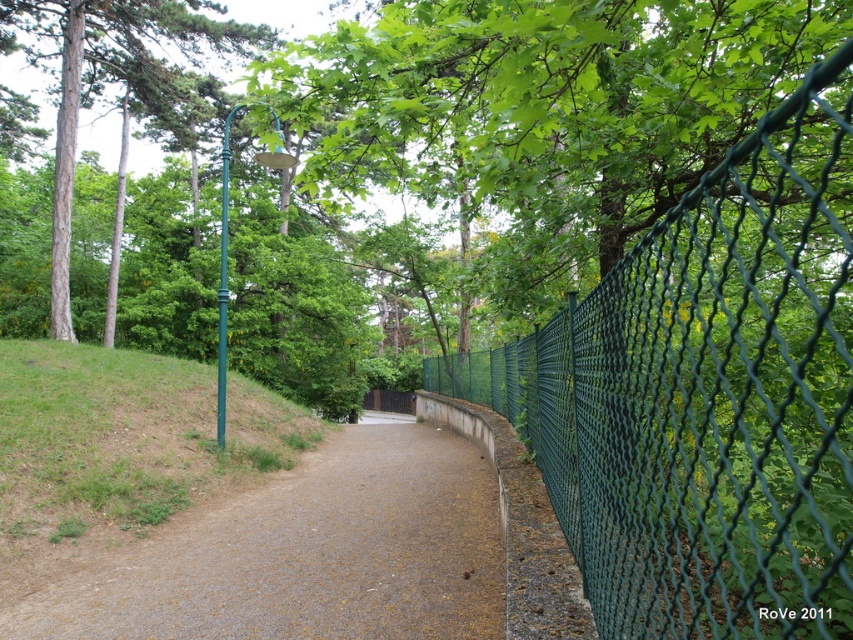
Is green mesh fence at right smaller than green metallic pole at upper center?

Yes.

Who is lower down, green mesh fence at right or green metallic pole at upper center?

Positioned lower is green mesh fence at right.

You are a GUI agent. You are given a task and a screenshot of the screen. Output one action in this format:
    pyautogui.click(x=<x>, y=<y>)
    Task: Click on the green mesh fence at right
    Image resolution: width=853 pixels, height=640 pixels.
    Given the screenshot: What is the action you would take?
    pyautogui.click(x=706, y=394)

Find the location of a particular element. This screenshot has height=640, width=853. green mesh fence at right is located at coordinates [706, 394].

What do you see at coordinates (706, 394) in the screenshot? I see `green mesh fence at right` at bounding box center [706, 394].

Who is more distant from viewer, (839,192) or (396,448)?

The point (396,448) is behind.

At what (x,y) coordinates should I click in order to perform the action: click on green mesh fence at right. Please return your answer as a coordinate pair (x, y). This screenshot has width=853, height=640. Looking at the image, I should click on (706, 394).

Which is behind, point (254, 630) or point (105, 42)?

The point (105, 42) is more distant.

Is brown gravel trail at center positioned at the back of green metallic pole at upper center?

No, it is not.

Who is more distant from viewer, (x=325, y=580) or (x=171, y=29)?

The point (x=171, y=29) is more distant.

Identify the location of brown gravel trail at center. (305, 554).